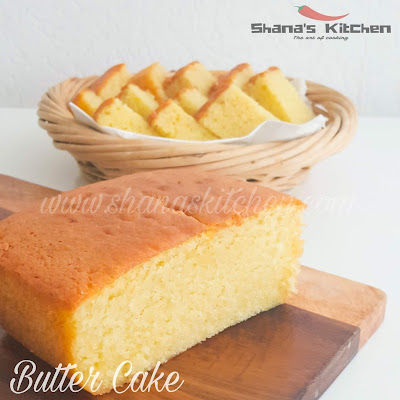
This screenshot has width=400, height=400. I want to click on rounded edge of the cutting board, so [384, 310].